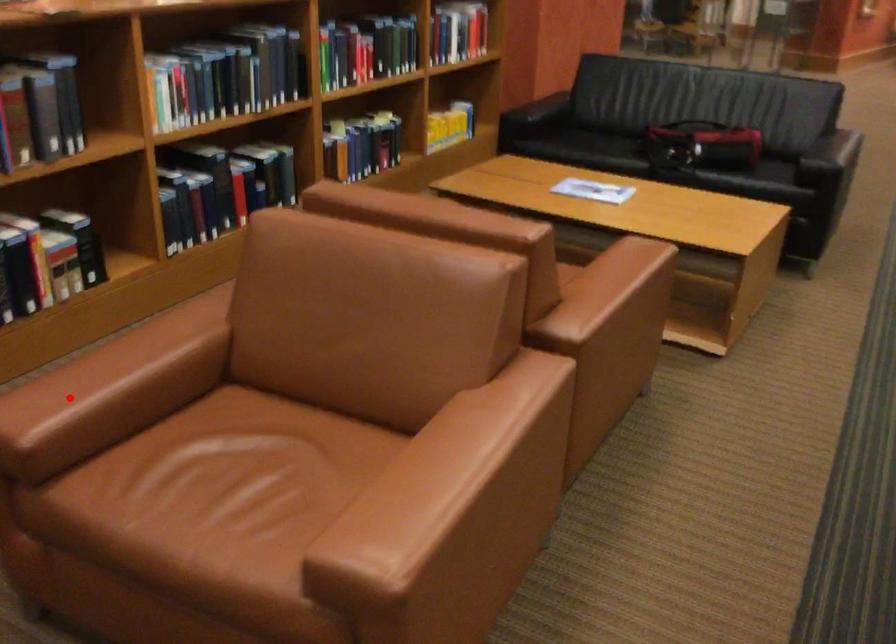
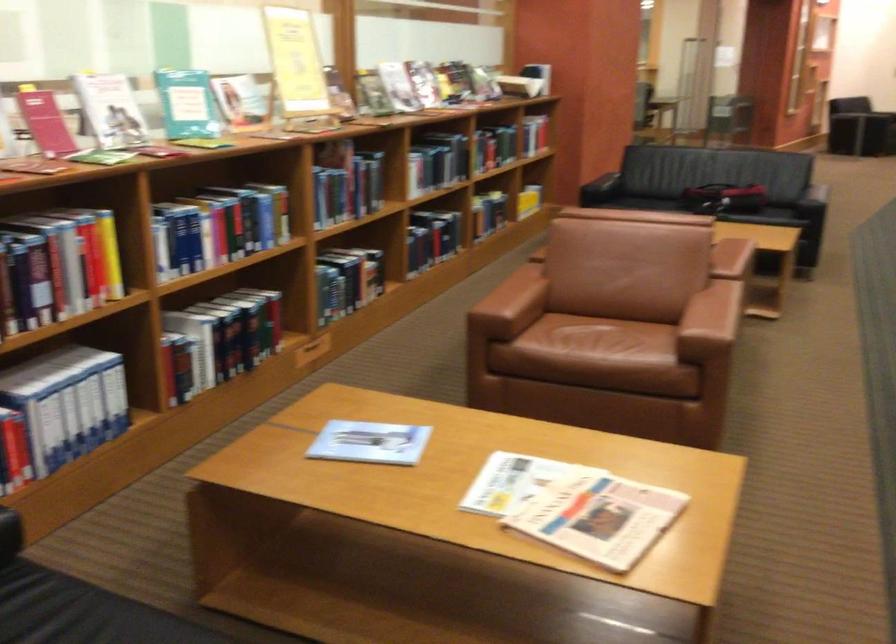
Question: I am providing you with two images of the same scene from different viewpoints. Image1 has a red point marked. In image2, the corresponding 3D location appears at what relative position? Reply with the corresponding letter.

Choices:
 (A) Closer
 (B) Farther

Answer: (B)